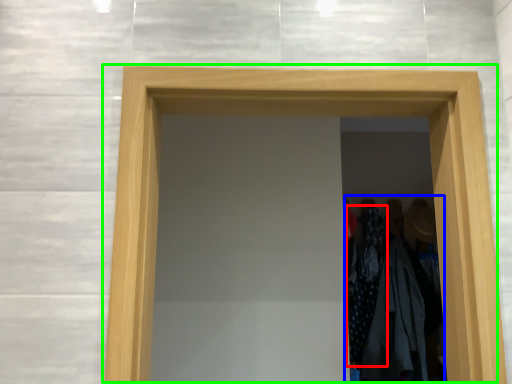
Question: Which is nearer to the clothing (highlighted by a red box)? laundry (highlighted by a blue box) or door (highlighted by a green box).

Choices:
 (A) laundry
 (B) door

Answer: (A)